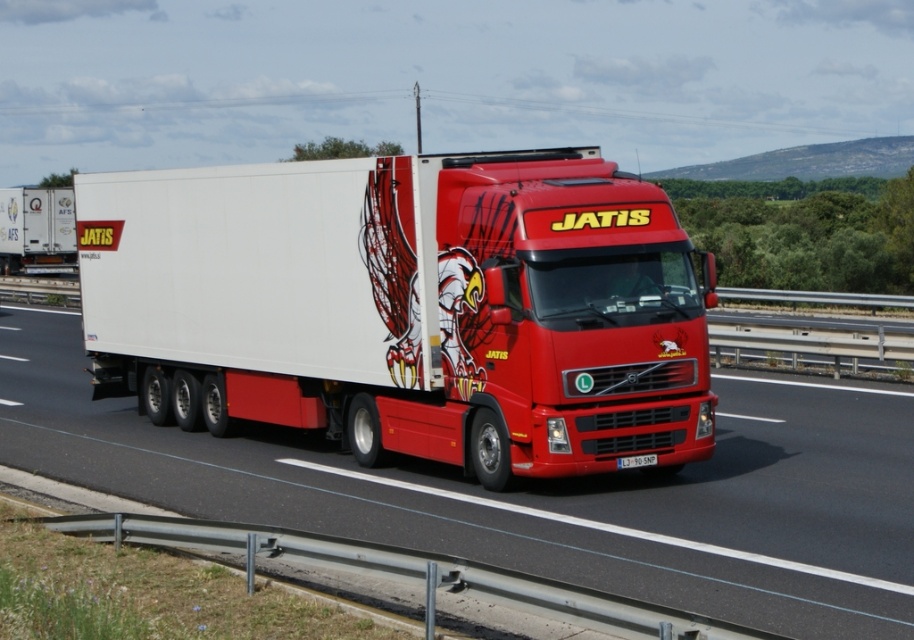
Question: Is white glossy trailer at center above white matte trailer at left?

Choices:
 (A) yes
 (B) no

Answer: (B)

Question: Among these objects, which one is nearest to the camera?

Choices:
 (A) white glossy trailer at center
 (B) white matte trailer at left
 (C) white plastic license plate at center

Answer: (A)

Question: Where is matte white trailer at center located in relation to white plastic license plate at center in the image?

Choices:
 (A) left
 (B) right

Answer: (A)

Question: Is matte white trailer at center to the right of white matte trailer at left from the viewer's perspective?

Choices:
 (A) yes
 (B) no

Answer: (A)

Question: Which point is farther to the camera?

Choices:
 (A) (48, 381)
 (B) (62, 243)
 (C) (639, 461)
 (D) (622, 422)

Answer: (B)

Question: Which of the following is the farthest from the observer?

Choices:
 (A) (67, 244)
 (B) (246, 435)
 (C) (617, 467)
 (D) (692, 420)

Answer: (A)